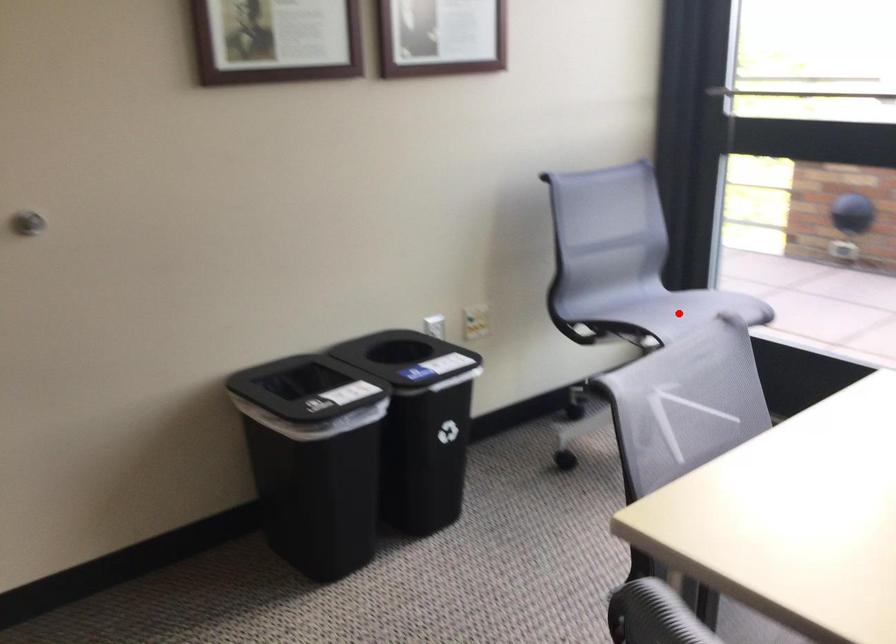
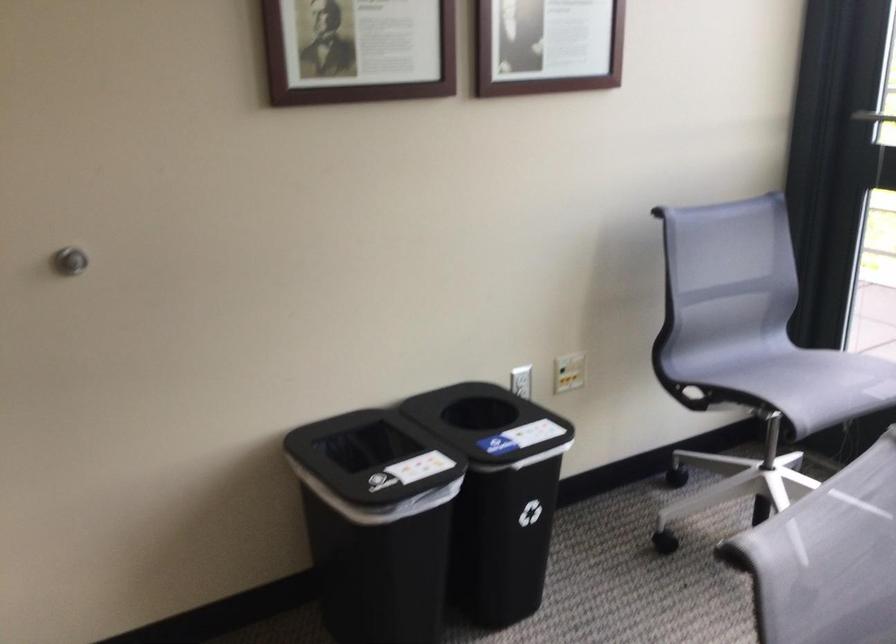
Find the pixel in the second image that matches the highlighted location in the first image.

(812, 382)